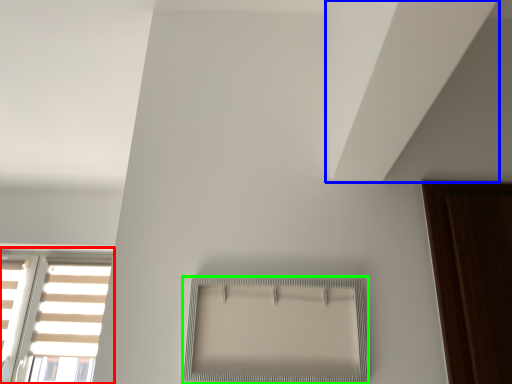
Question: Considering the real-world distances, which object is closest to window (highlighted by a red box)? blind (highlighted by a blue box) or window (highlighted by a green box).

Choices:
 (A) blind
 (B) window

Answer: (B)